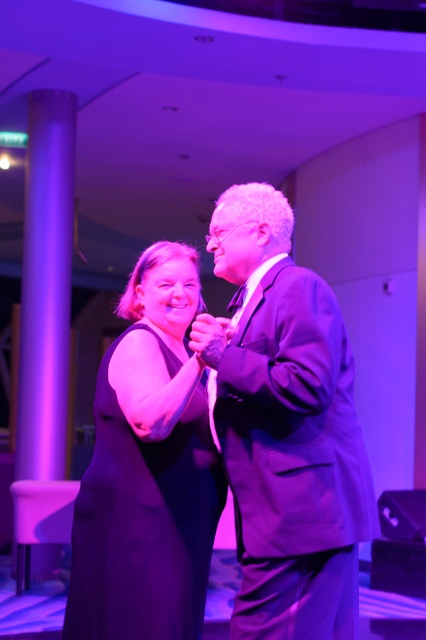
Is satin black suit at center positioned at the back of matte black dress at center?

That is False.

Which is in front, point (305, 561) or point (103, 552)?

Positioned in front is point (305, 561).

At what (x,y) coordinates should I click in order to perform the action: click on satin black suit at center. Please return your answer as a coordinate pair (x, y). This screenshot has width=426, height=640. Looking at the image, I should click on (285, 428).